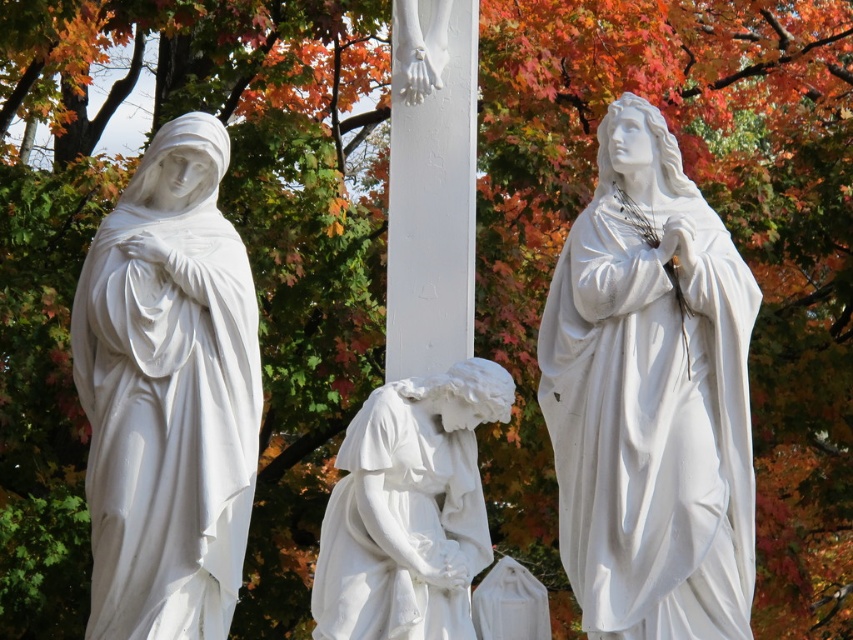
Does white marble statue at right appear over white marble statue at left?

Yes, white marble statue at right is above white marble statue at left.

Does point (608, 177) lie in front of point (210, 205)?

No.

Locate an element on the screen. white marble statue at right is located at coordinates (650, 397).

Is white marble statue at right taller than white marble statue at center?

Yes, white marble statue at right is taller than white marble statue at center.

Does white marble statue at right have a lesser width compared to white marble statue at center?

In fact, white marble statue at right might be wider than white marble statue at center.

Which is in front, point (561, 289) or point (390, 465)?

Point (390, 465) is in front.

Image resolution: width=853 pixels, height=640 pixels. I want to click on white marble statue at right, so click(x=650, y=397).

Is white marble statue at left wider than white marble statue at center?

Indeed, white marble statue at left has a greater width compared to white marble statue at center.

Is point (125, 355) closer to camera compared to point (483, 518)?

Yes, point (125, 355) is in front of point (483, 518).

What do you see at coordinates (167, 394) in the screenshot?
I see `white marble statue at left` at bounding box center [167, 394].

Locate an element on the screen. white marble statue at left is located at coordinates (167, 394).